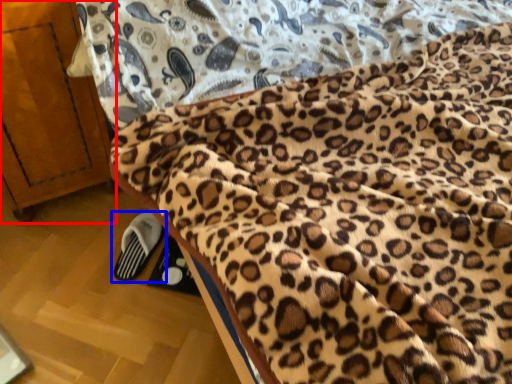
Question: Which object appears closest to the camera in this image, furniture (highlighted by a red box) or footwear (highlighted by a blue box)?

Choices:
 (A) furniture
 (B) footwear

Answer: (A)